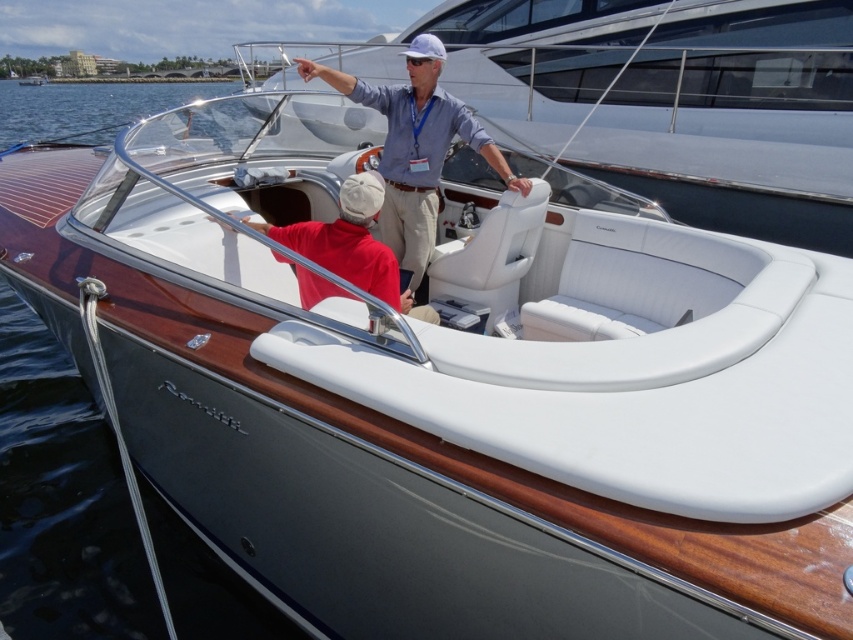
Is matte blue shirt at center thinner than red matte shirt at center?

No, matte blue shirt at center is not thinner than red matte shirt at center.

Can you confirm if matte blue shirt at center is positioned to the left of red matte shirt at center?

No, matte blue shirt at center is not to the left of red matte shirt at center.

Is point (379, 99) closer to viewer compared to point (334, 266)?

No, it is not.

The width and height of the screenshot is (853, 640). Find the location of `matte blue shirt at center`. matte blue shirt at center is located at coordinates (416, 148).

Is white leather boat at center thinner than red matte shirt at center?

Correct, white leather boat at center's width is less than red matte shirt at center's.

Is the position of white leather boat at center more distant than that of red matte shirt at center?

Yes, white leather boat at center is further from the viewer.

Is point (361, 52) in front of point (392, 260)?

No, it is behind (392, 260).

Locate an element on the screen. The height and width of the screenshot is (640, 853). white leather boat at center is located at coordinates (674, 100).

Can you confirm if white leather boat at center is thinner than matte blue shirt at center?

Correct, white leather boat at center's width is less than matte blue shirt at center's.

Where is `white leather boat at center`? The height and width of the screenshot is (640, 853). white leather boat at center is located at coordinates (674, 100).